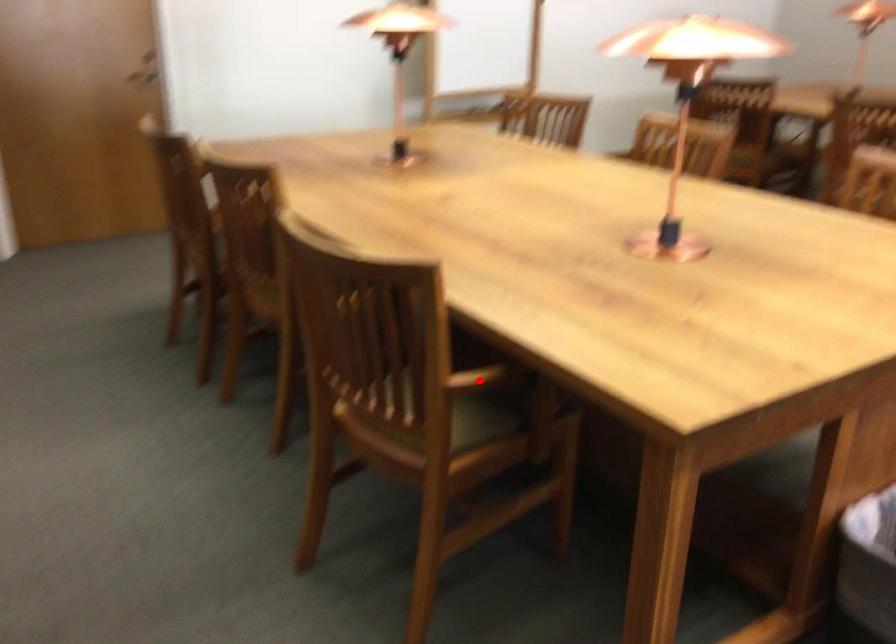
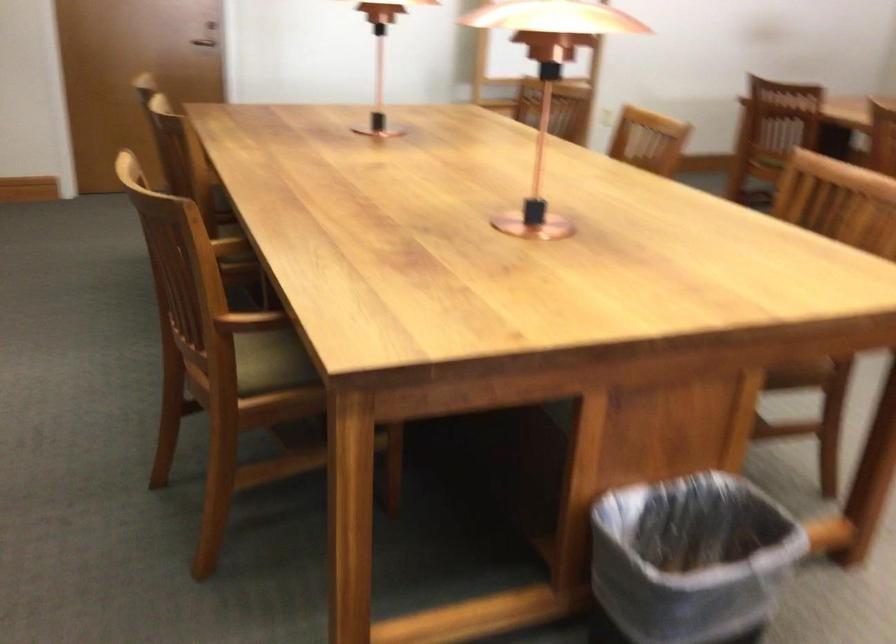
Where in the second image is the point corresponding to the highlighted location from the first image?

(250, 321)